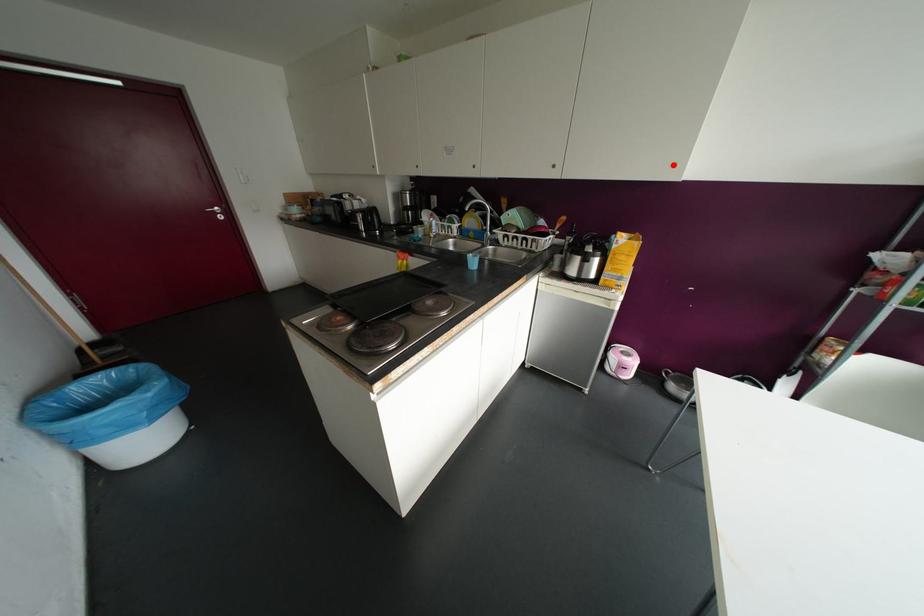
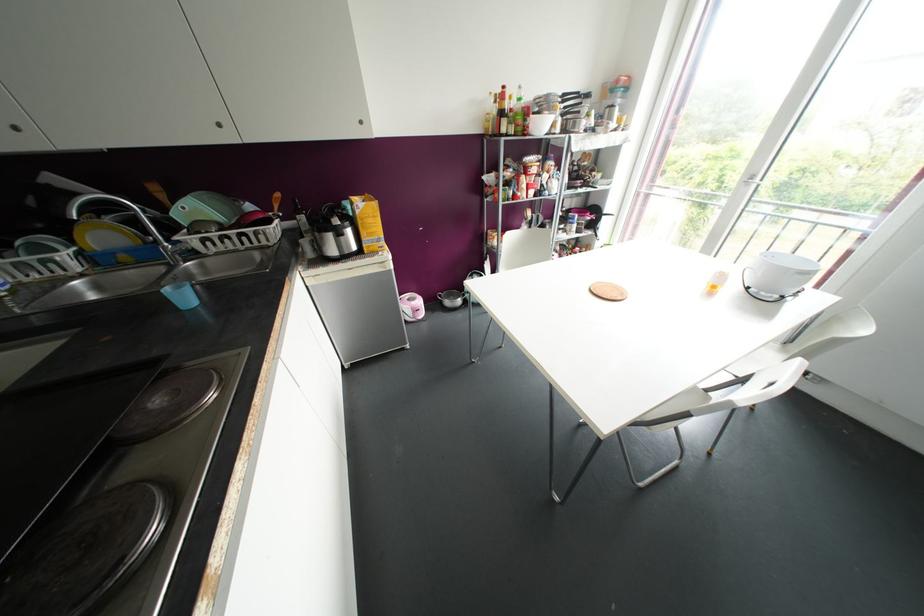
Find the pixel in the second image that matches the highlighted location in the first image.

(360, 122)